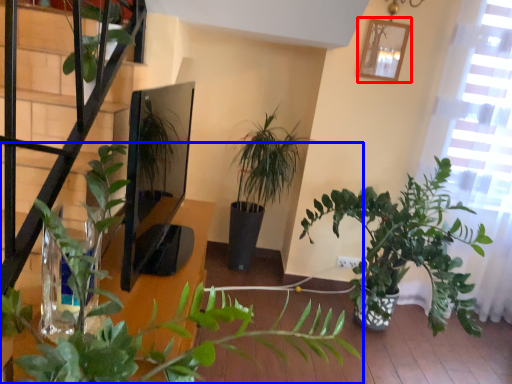
Question: Which object appears closest to the camera in this image, picture frame (highlighted by a red box) or houseplant (highlighted by a blue box)?

Choices:
 (A) picture frame
 (B) houseplant

Answer: (B)